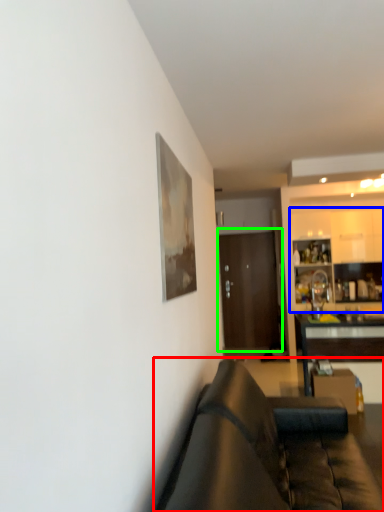
Question: Considering the real-world distances, which object is closest to studio couch (highlighted by a red box)? cabinetry (highlighted by a blue box) or door (highlighted by a green box).

Choices:
 (A) cabinetry
 (B) door

Answer: (A)